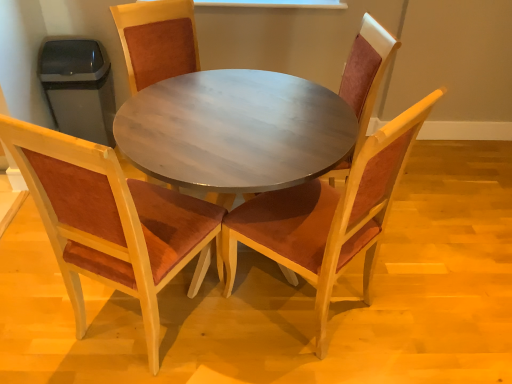
Question: Which direction should I rotate to face wooden chair with brown cushion at center, the 2th chair in the left-to-right sequence, — up or down?

Choices:
 (A) down
 (B) up

Answer: (B)

Question: Is wooden chair with brown cushion at center, acting as the third chair starting from the right, surrounding velvet red chair at center, the third chair when ordered from left to right?

Choices:
 (A) yes
 (B) no

Answer: (B)

Question: Is the position of wooden chair with brown cushion at center, the 2th chair in the left-to-right sequence, more distant than that of velvet red chair at center, the third chair when ordered from left to right?

Choices:
 (A) no
 (B) yes

Answer: (B)

Question: Can you confirm if wooden chair with brown cushion at center, the 2th chair in the left-to-right sequence, is positioned to the left of velvet red chair at center, the third chair when ordered from left to right?

Choices:
 (A) yes
 (B) no

Answer: (A)

Question: Is wooden chair with brown cushion at center, acting as the third chair starting from the right, not close to velvet red chair at center, which is counted as the second chair, starting from the right?

Choices:
 (A) yes
 (B) no

Answer: (A)

Question: From a real-world perspective, is wooden chair with brown cushion at center, the 2th chair in the left-to-right sequence, under velvet red chair at center, the third chair when ordered from left to right?

Choices:
 (A) no
 (B) yes

Answer: (A)

Question: Could you tell me if wooden chair with brown cushion at center, the 2th chair in the left-to-right sequence, is turned towards velvet red chair at center, the third chair when ordered from left to right?

Choices:
 (A) yes
 (B) no

Answer: (A)

Question: Is wooden table at center beside velvet brown chair at left, arranged as the first chair when viewed from the left?

Choices:
 (A) no
 (B) yes

Answer: (A)

Question: Can you confirm if wooden table at center is shorter than velvet brown chair at left, arranged as the first chair when viewed from the left?

Choices:
 (A) yes
 (B) no

Answer: (A)

Question: Is wooden table at center to the right of velvet brown chair at left, arranged as the first chair when viewed from the left, from the viewer's perspective?

Choices:
 (A) no
 (B) yes

Answer: (B)

Question: Would you consider wooden table at center to be distant from velvet brown chair at left, which ranks as the fourth chair in right-to-left order?

Choices:
 (A) yes
 (B) no

Answer: (B)

Question: From the image's perspective, would you say wooden table at center is shown under velvet brown chair at left, arranged as the first chair when viewed from the left?

Choices:
 (A) no
 (B) yes

Answer: (A)

Question: From a real-world perspective, is wooden table at center physically below velvet brown chair at left, which ranks as the fourth chair in right-to-left order?

Choices:
 (A) yes
 (B) no

Answer: (A)

Question: From a real-world perspective, is velvet burgundy chair at center, which is the first chair in right-to-left order, beneath wooden chair with brown cushion at center, the 2th chair in the left-to-right sequence?

Choices:
 (A) no
 (B) yes

Answer: (B)